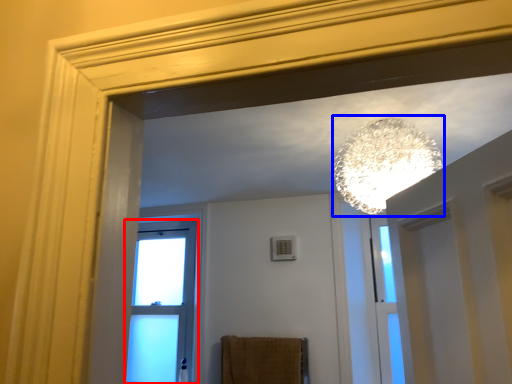
Question: Which object appears farthest to the camera in this image, window (highlighted by a red box) or lamp (highlighted by a blue box)?

Choices:
 (A) window
 (B) lamp

Answer: (A)